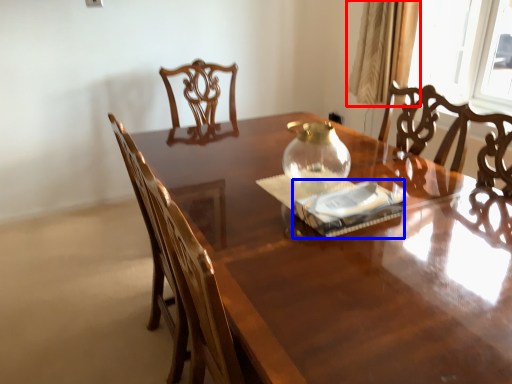
Question: Which of the following is the farthest to the observer, curtain (highlighted by a red box) or paperback book (highlighted by a blue box)?

Choices:
 (A) curtain
 (B) paperback book

Answer: (A)